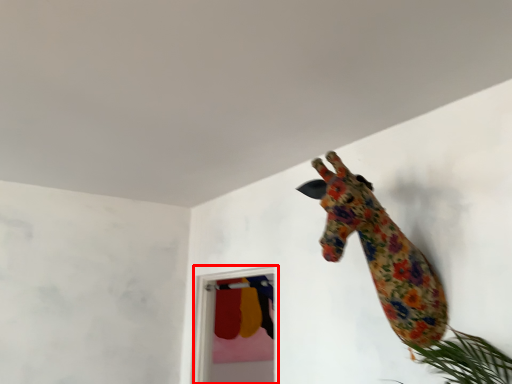
Question: From the image's perspective, what is the correct spatial relationship of glass door (annotated by the red box) in relation to giraffe?

Choices:
 (A) below
 (B) above

Answer: (A)